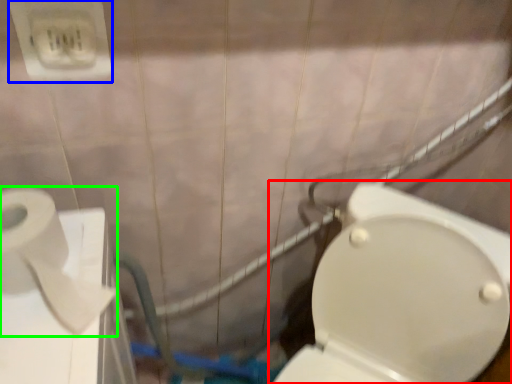
Question: Which is farther away from toilet (highlighted by a red box)? electric outlet (highlighted by a blue box) or toilet paper (highlighted by a green box)?

Choices:
 (A) electric outlet
 (B) toilet paper

Answer: (A)